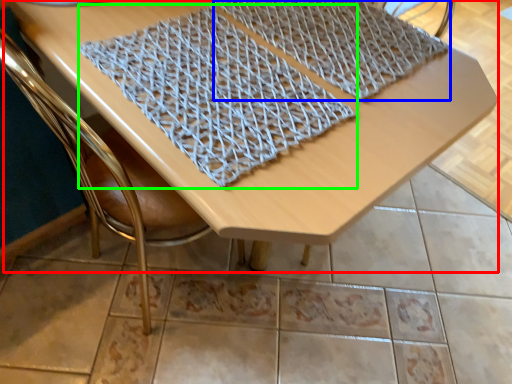
Question: Which is farther away from table (highlighted by a red box)? blanket (highlighted by a blue box) or blanket (highlighted by a green box)?

Choices:
 (A) blanket
 (B) blanket

Answer: (A)